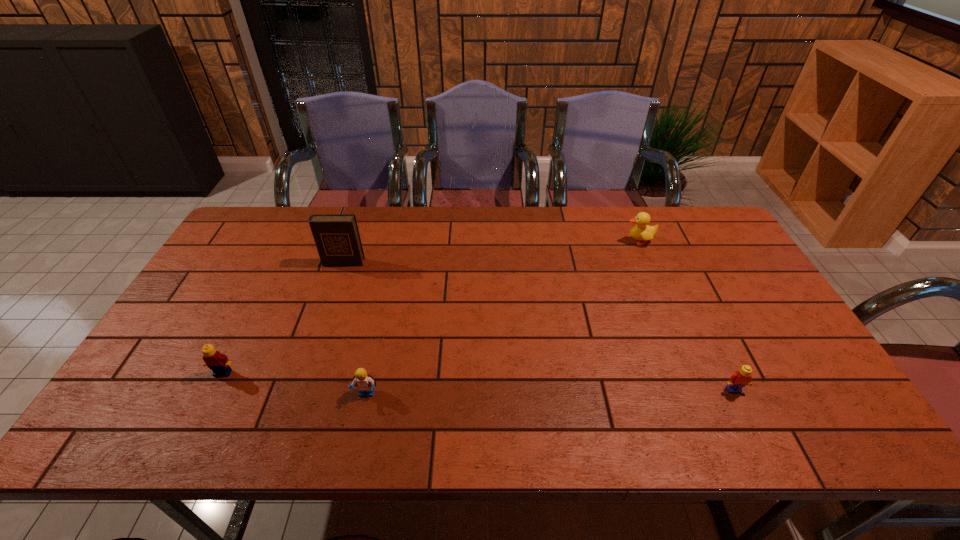
Identify the location of the fourth object from right to left. (337, 238).

Where is `the fourth nearest object`? This screenshot has height=540, width=960. the fourth nearest object is located at coordinates (337, 238).

This screenshot has height=540, width=960. In order to click on the farthest object in this screenshot , I will do `click(642, 231)`.

Locate an element on the screen. Image resolution: width=960 pixels, height=540 pixels. the farthest Lego is located at coordinates (218, 363).

Where is `the third farthest object`? the third farthest object is located at coordinates [218, 363].

Find the location of `the second Lego from right to left`. the second Lego from right to left is located at coordinates (365, 382).

You are a GUI agent. You are given a task and a screenshot of the screen. Output one action in this format:
    pyautogui.click(x=<x>, y=<y>)
    Task: Click on the rightmost Lego
    
    Given the screenshot: What is the action you would take?
    pyautogui.click(x=741, y=378)

Where is `vacant area located on the front cover of the diary`? vacant area located on the front cover of the diary is located at coordinates (304, 374).

I want to click on vacant space situated on the front-facing side of the farthest object, so click(558, 241).

Find the location of a particular element. The image size is (960, 540). vacant space located 0.080m on the front-facing side of the farthest object is located at coordinates (600, 241).